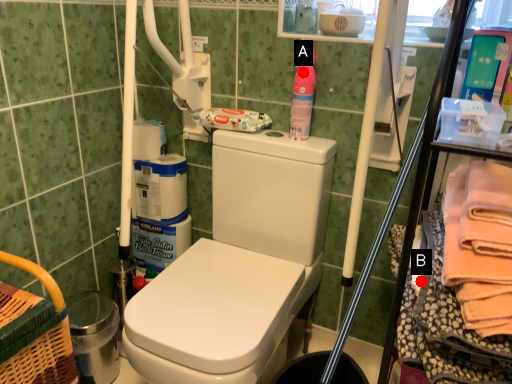
Question: Two points are circled on the image, labeled by A and B beside each circle. Which point is farther to the camera?

Choices:
 (A) A is further
 (B) B is further

Answer: (A)